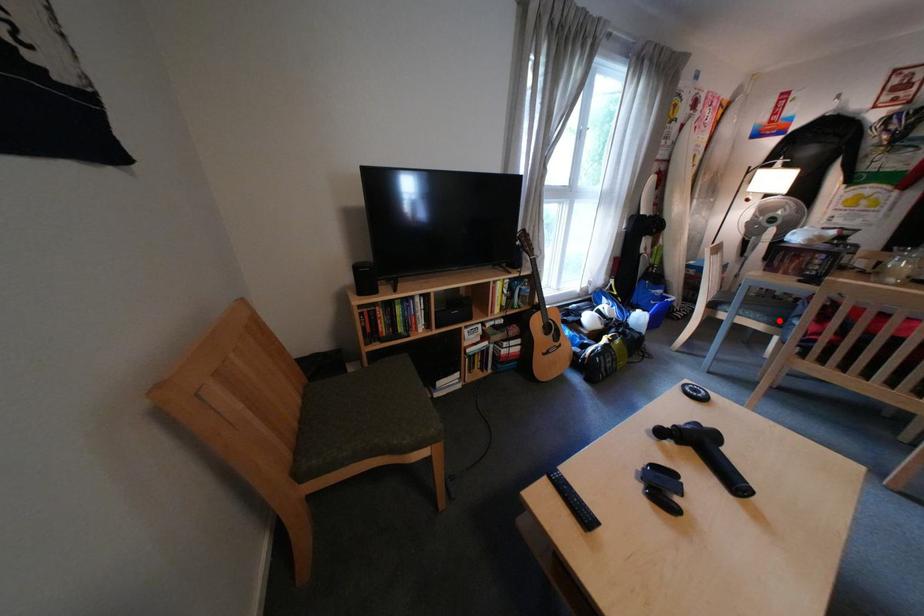
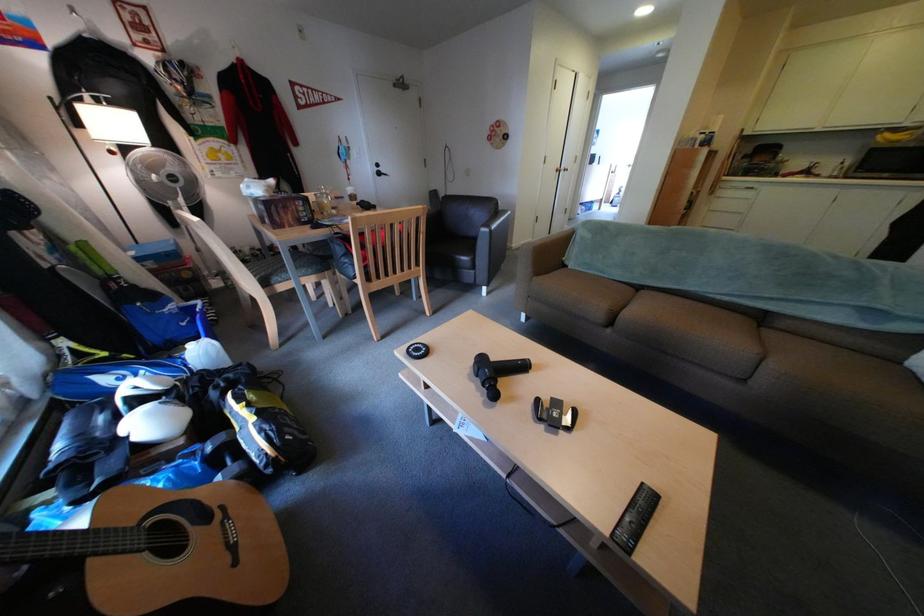
Question: A red point is marked in image1. In image2, is the corresponding 3D point closer to the camera or farther? Reply with the corresponding letter.

Choices:
 (A) The corresponding 3D point is closer.
 (B) The corresponding 3D point is farther.

Answer: (A)